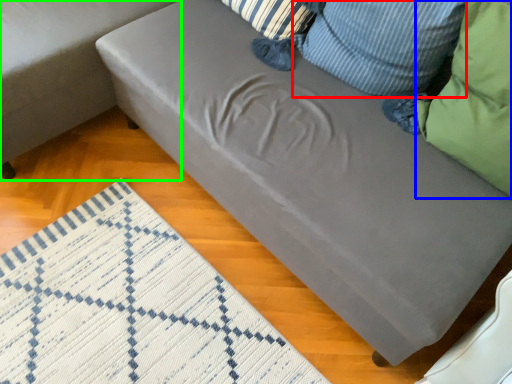
Question: Which object is the closest to the pillow (highlighted by a red box)? Choose among these: pillow (highlighted by a blue box) or studio couch (highlighted by a green box).

Choices:
 (A) pillow
 (B) studio couch

Answer: (A)